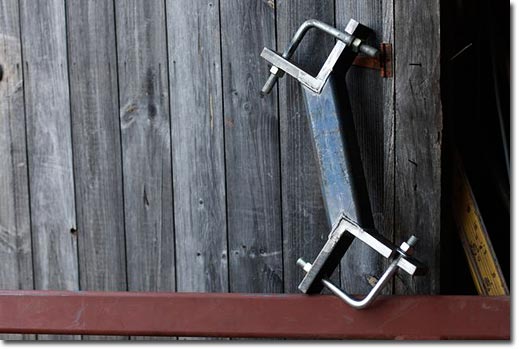
You are a GUI agent. You are given a task and a screenshot of the screen. Output one action in this format:
    pyautogui.click(x=<x>, y=<y>)
    Task: Click on the door hinge
    The image size is (519, 349).
    Given the screenshot: What is the action you would take?
    pyautogui.click(x=389, y=61), pyautogui.click(x=373, y=63)